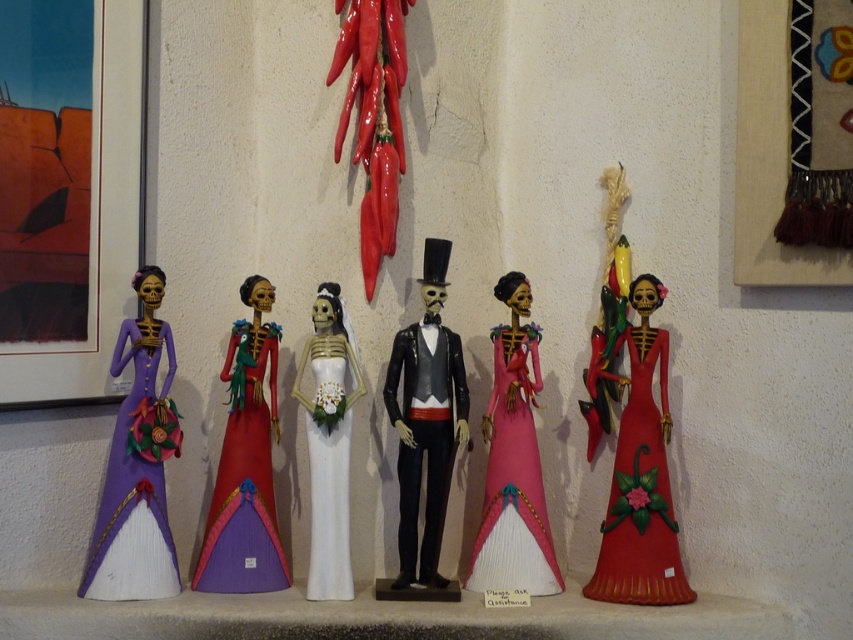
Who is positioned more to the right, matte purple paper doll at left or matte painted wooden skeleton at center?

Positioned to the right is matte painted wooden skeleton at center.

Between point (91, 561) and point (231, 452), which one is positioned in front?

Point (91, 561) is more forward.

Locate an element on the screen. Image resolution: width=853 pixels, height=640 pixels. matte purple paper doll at left is located at coordinates (138, 465).

Does matte red clay doll at right appear under pink papier-mâché doll at center?

Indeed, matte red clay doll at right is positioned under pink papier-mâché doll at center.

Which is more to the right, matte red clay doll at right or pink papier-mâché doll at center?

matte red clay doll at right is more to the right.

The image size is (853, 640). Find the location of `matte red clay doll at right`. matte red clay doll at right is located at coordinates (641, 476).

Locate an element on the screen. Image resolution: width=853 pixels, height=640 pixels. matte red clay doll at right is located at coordinates (641, 476).

Can you confirm if matte purple paper doll at left is bigger than white matte wedding dress at center?

Yes.

From the picture: Which is more to the left, matte purple paper doll at left or white matte wedding dress at center?

From the viewer's perspective, matte purple paper doll at left appears more on the left side.

Who is more forward, (142, 438) or (326, 573)?

Positioned in front is point (142, 438).

Locate an element on the screen. matte purple paper doll at left is located at coordinates (138, 465).